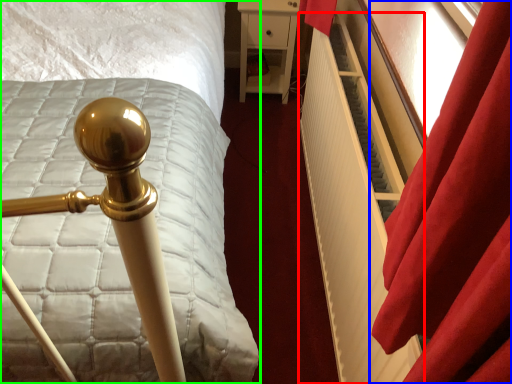
Question: Which object is positioned farthest from radiator (highlighted by a red box)? Select from curtain (highlighted by a blue box) and bed (highlighted by a green box).

Choices:
 (A) curtain
 (B) bed

Answer: (B)